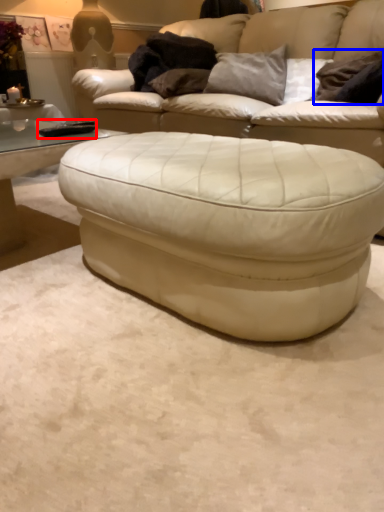
Question: Among these objects, which one is farthest to the camera, pad (highlighted by a red box) or pillow (highlighted by a blue box)?

Choices:
 (A) pad
 (B) pillow

Answer: (B)